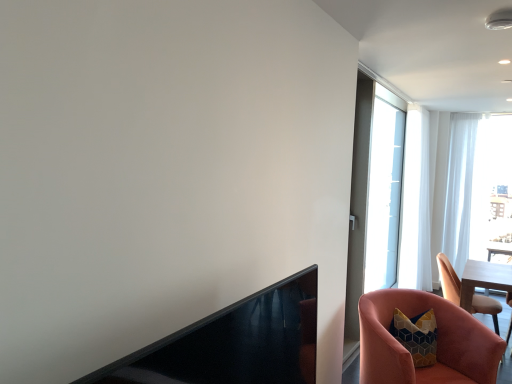
Question: Is black glossy fireplace at lower left taller or shorter than pink velvet chair at lower right, the 1th chair viewed from the front?

Choices:
 (A) tall
 (B) short

Answer: (B)

Question: Would you say black glossy fireplace at lower left is inside or outside pink velvet chair at lower right, the 1th chair viewed from the front?

Choices:
 (A) outside
 (B) inside

Answer: (A)

Question: Which object is positioned closest to the white sheer curtain at right, which is the 1th curtain from right to left?

Choices:
 (A) pink velvet chair at lower right, the 2th chair from the right
 (B) white sheer curtain at right, the 2th curtain viewed from the right
 (C) transparent glass screen door at upper right
 (D) black glossy fireplace at lower left
 (E) pink velvet chair at lower right, the 1th chair from the back

Answer: (B)

Question: Which object is positioned farthest from the pink velvet chair at lower right, the 1th chair viewed from the front?

Choices:
 (A) transparent glass screen door at upper right
 (B) white sheer curtain at right, placed as the second curtain when sorted from left to right
 (C) white sheer curtain at right, the 2th curtain viewed from the right
 (D) black glossy fireplace at lower left
 (E) pink velvet chair at lower right, which ranks as the 1th chair in right-to-left order

Answer: (C)